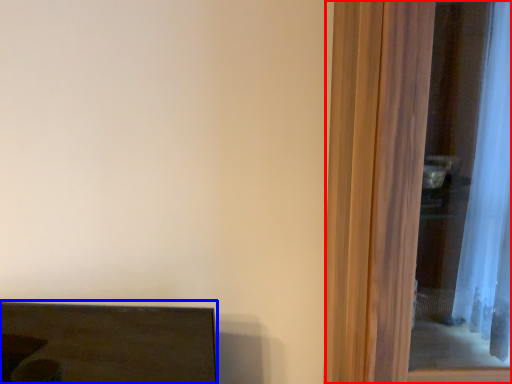
Question: Which object appears farthest to the camera in this image, screen door (highlighted by a red box) or furniture (highlighted by a blue box)?

Choices:
 (A) screen door
 (B) furniture

Answer: (B)